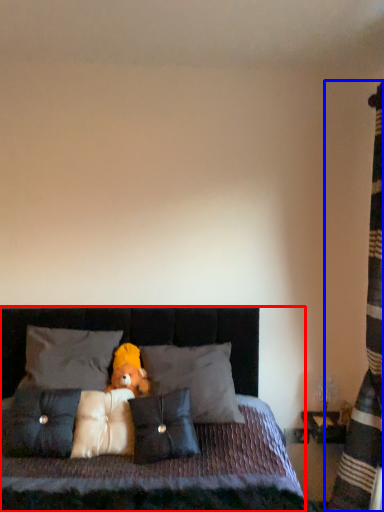
Question: Which of the following is the closest to the observer, bed (highlighted by a red box) or curtain (highlighted by a blue box)?

Choices:
 (A) bed
 (B) curtain

Answer: (A)